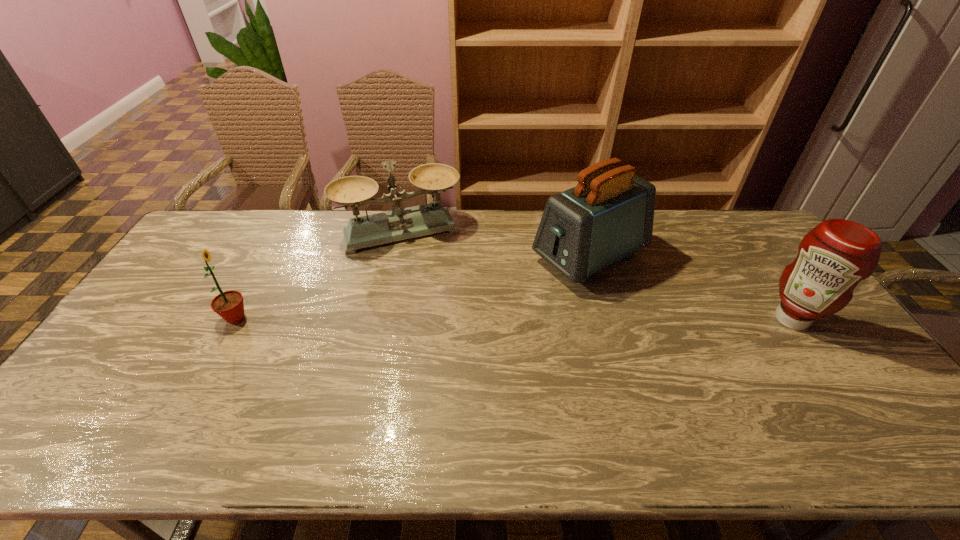
Find the location of a particular element. sunflower is located at coordinates coord(229,305).

At what (x,y) coordinates should I click in order to perform the action: click on the rightmost object. Please return your answer as a coordinate pair (x, y). This screenshot has height=540, width=960. Looking at the image, I should click on (837, 254).

In order to click on the third object from left to right in this screenshot , I will do `click(608, 216)`.

Locate an element on the screen. The image size is (960, 540). scale is located at coordinates (355, 191).

The width and height of the screenshot is (960, 540). I want to click on vacant region located on the face of the sunflower, so click(312, 318).

What are the coordinates of `vacant region located on the left of the condiment` in the screenshot? It's located at (713, 319).

Find the location of a particular element. The width and height of the screenshot is (960, 540). vacant area situated on the front-facing side of the second object from right to left is located at coordinates (458, 320).

You are a GUI agent. You are given a task and a screenshot of the screen. Output one action in this format:
    pyautogui.click(x=<x>, y=<y>)
    Task: Click on the blank space located 0.070m on the front-facing side of the second object from right to left
    
    Given the screenshot: What is the action you would take?
    pyautogui.click(x=526, y=286)

Identify the location of blank space located 0.190m on the front-facing side of the second object from right to left. (495, 302).

You are a GUI agent. You are given a task and a screenshot of the screen. Output one action in this format:
    pyautogui.click(x=<x>, y=<y>)
    Task: Click on the free space located 0.360m on the front-facing side of the third object from right to left
    
    Given the screenshot: What is the action you would take?
    pyautogui.click(x=446, y=332)